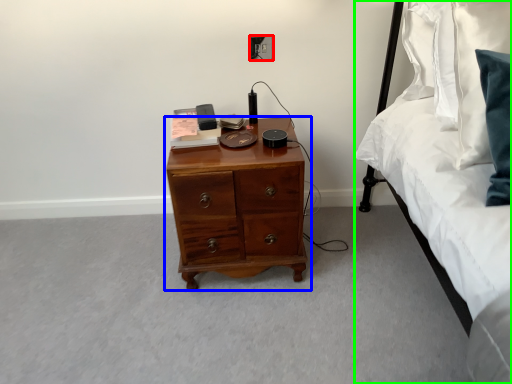
Question: Which object is positioned closest to electric outlet (highlighted by a red box)? Select from chest of drawers (highlighted by a blue box) and bed (highlighted by a green box).

Choices:
 (A) chest of drawers
 (B) bed

Answer: (A)